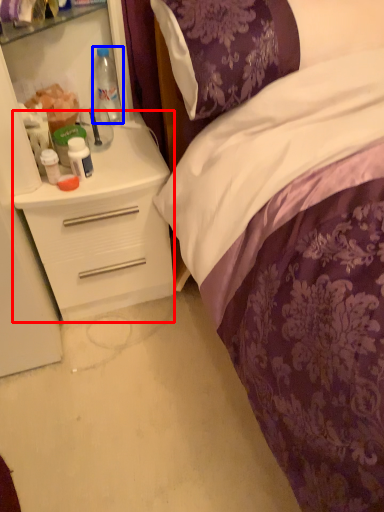
Question: Which object appears closest to the camera in this image, desk (highlighted by a red box) or bottle (highlighted by a blue box)?

Choices:
 (A) desk
 (B) bottle

Answer: (A)